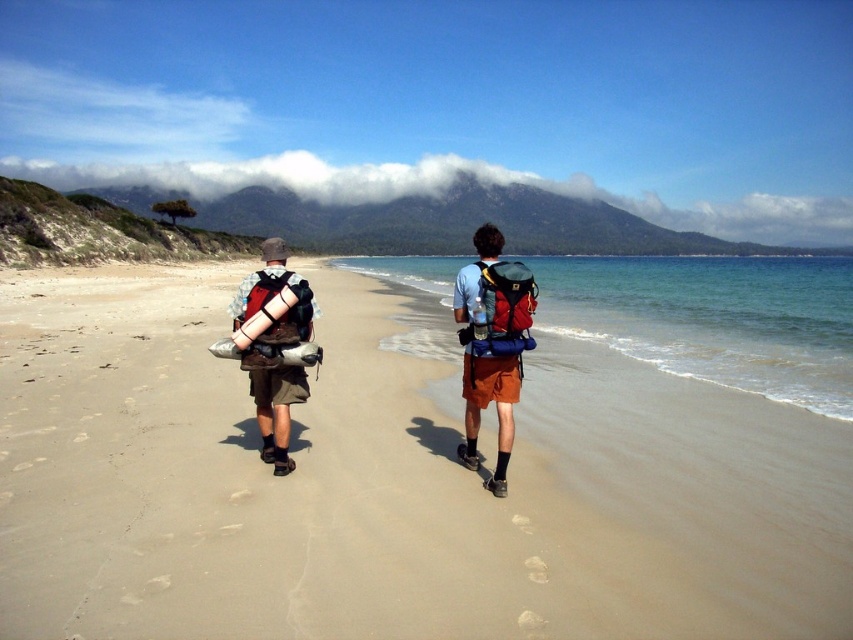
Question: Which is nearer to the beige sand at center?

Choices:
 (A) matte blue shirt at center
 (B) camouflage fabric backpack at center
 (C) camouflage-patterned backpack at center
 (D) clear water at right

Answer: (B)

Question: Can you confirm if beige sand at center is positioned below camouflage-patterned backpack at center?

Choices:
 (A) no
 (B) yes

Answer: (A)

Question: Is clear water at right to the left of matte blue shirt at center from the viewer's perspective?

Choices:
 (A) no
 (B) yes

Answer: (A)

Question: Which point is farther to the camera?

Choices:
 (A) (636, 272)
 (B) (535, 301)
 (C) (187, 561)
 (D) (491, 280)

Answer: (A)

Question: Is beige sand at center to the right of clear water at right from the viewer's perspective?

Choices:
 (A) yes
 (B) no

Answer: (B)

Question: Which point is closer to the camera?

Choices:
 (A) camouflage fabric backpack at center
 (B) clear water at right
 (C) camouflage-patterned backpack at center

Answer: (C)